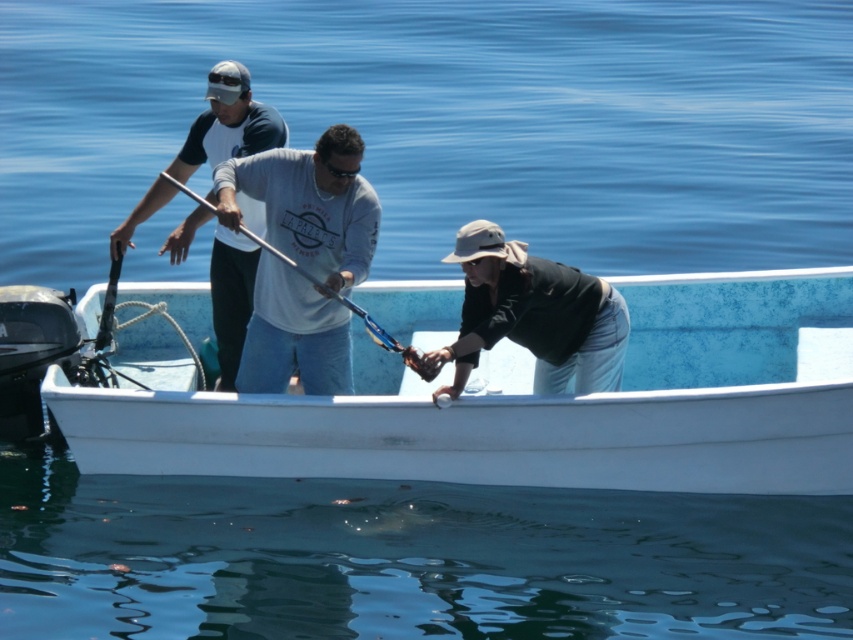
Consider the image. You are on a boat and need to retrieve the metallic blue paddle at center to help stabilize the boat. Which direction should you move relative to the matte white shirt at center?

The metallic blue paddle at center is behind the matte white shirt at center, so you should move backward relative to the matte white shirt at center to retrieve it.

You are standing on the boat and want to place a heavy object on the closest point to you between point (556, 445) and point (274, 147). Which point should you choose?

Point (556, 445) is closer to the viewer than point (274, 147), so you should choose point (556, 445).

Is the white matte boat at center located to the left or right of the point at coordinates (x=524, y=404)?

The white matte boat at center is located at the point at coordinates (x=524, y=404).